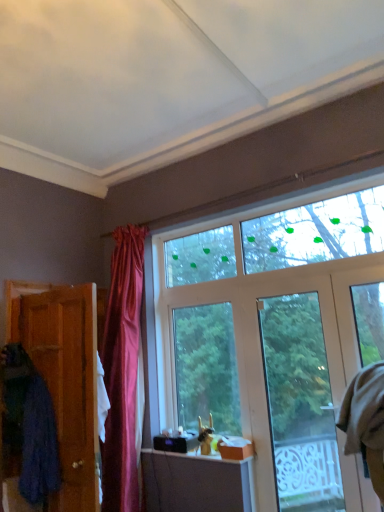
Question: Can you confirm if beige fabric robe at right, which is the 2th robe in left-to-right order, is thinner than clear glass door at center?

Choices:
 (A) no
 (B) yes

Answer: (B)

Question: Is beige fabric robe at right, which ranks as the first robe in right-to-left order, aimed at clear glass door at center?

Choices:
 (A) yes
 (B) no

Answer: (B)

Question: Is beige fabric robe at right, which is the 2th robe in left-to-right order, positioned in front of clear glass door at center?

Choices:
 (A) yes
 (B) no

Answer: (A)

Question: Is beige fabric robe at right, which is the 2th robe in left-to-right order, bigger than clear glass door at center?

Choices:
 (A) yes
 (B) no

Answer: (B)

Question: Does beige fabric robe at right, which is the 2th robe in left-to-right order, have a greater width compared to clear glass door at center?

Choices:
 (A) no
 (B) yes

Answer: (A)

Question: Is the surface of beige fabric robe at right, which is the 2th robe in left-to-right order, in direct contact with clear glass door at center?

Choices:
 (A) yes
 (B) no

Answer: (B)

Question: Is blue fabric robe at left, the 1th robe when ordered from left to right, in contact with beige fabric robe at right, which is the 2th robe in left-to-right order?

Choices:
 (A) no
 (B) yes

Answer: (A)

Question: Does blue fabric robe at left, positioned as the 2th robe in right-to-left order, turn towards beige fabric robe at right, which ranks as the first robe in right-to-left order?

Choices:
 (A) yes
 (B) no

Answer: (B)

Question: From the image's perspective, does blue fabric robe at left, the 1th robe when ordered from left to right, appear lower than beige fabric robe at right, which is the 2th robe in left-to-right order?

Choices:
 (A) yes
 (B) no

Answer: (A)

Question: Can beige fabric robe at right, which ranks as the first robe in right-to-left order, be found inside blue fabric robe at left, positioned as the 2th robe in right-to-left order?

Choices:
 (A) no
 (B) yes

Answer: (A)

Question: Does blue fabric robe at left, positioned as the 2th robe in right-to-left order, have a lesser width compared to beige fabric robe at right, which is the 2th robe in left-to-right order?

Choices:
 (A) no
 (B) yes

Answer: (A)

Question: Is blue fabric robe at left, positioned as the 2th robe in right-to-left order, closer to the viewer compared to beige fabric robe at right, which ranks as the first robe in right-to-left order?

Choices:
 (A) no
 (B) yes

Answer: (B)

Question: Is blue fabric robe at left, positioned as the 2th robe in right-to-left order, directly adjacent to clear glass door at center?

Choices:
 (A) no
 (B) yes

Answer: (A)